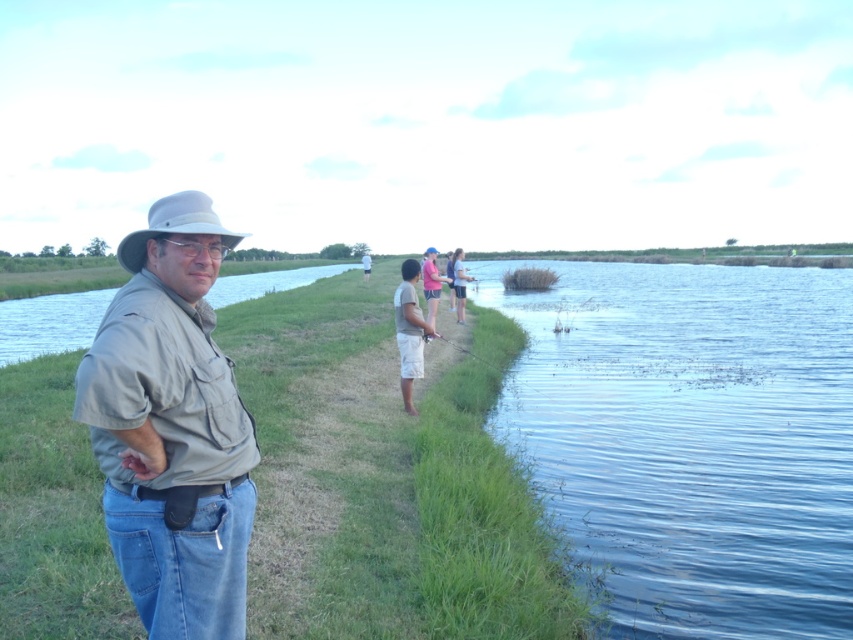
Question: Which is nearer to the light blue denim shorts at center?

Choices:
 (A) clear blue water at right
 (B) tan cotton shorts at center

Answer: (B)

Question: Which object is farther from the camera taking this photo?

Choices:
 (A) light blue denim shorts at center
 (B) pink fabric shirt at center
 (C) tan cotton shorts at center

Answer: (A)

Question: Can you confirm if clear blue water at right is positioned below blue-green water at center?

Choices:
 (A) yes
 (B) no

Answer: (A)

Question: Does pink fabric shirt at center have a smaller size compared to blue fabric hat at center?

Choices:
 (A) no
 (B) yes

Answer: (A)

Question: Which point is closer to the camera?

Choices:
 (A) pink fabric shirt at center
 (B) clear blue water at right
 (C) light blue denim shorts at center
 (D) light blue denim jeans at center

Answer: (B)

Question: Can you confirm if light blue denim jeans at center is positioned to the left of blue fabric hat at center?

Choices:
 (A) no
 (B) yes

Answer: (B)